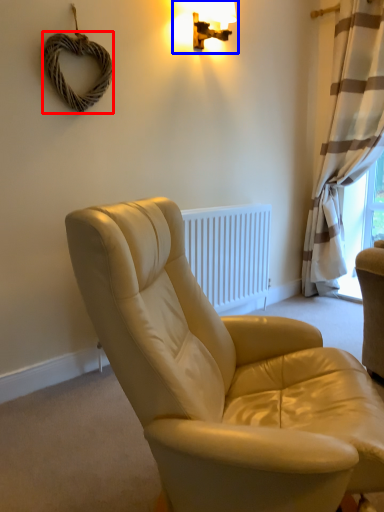
Question: Among these objects, which one is farthest to the camera, rope (highlighted by a red box) or lamp (highlighted by a blue box)?

Choices:
 (A) rope
 (B) lamp

Answer: (B)